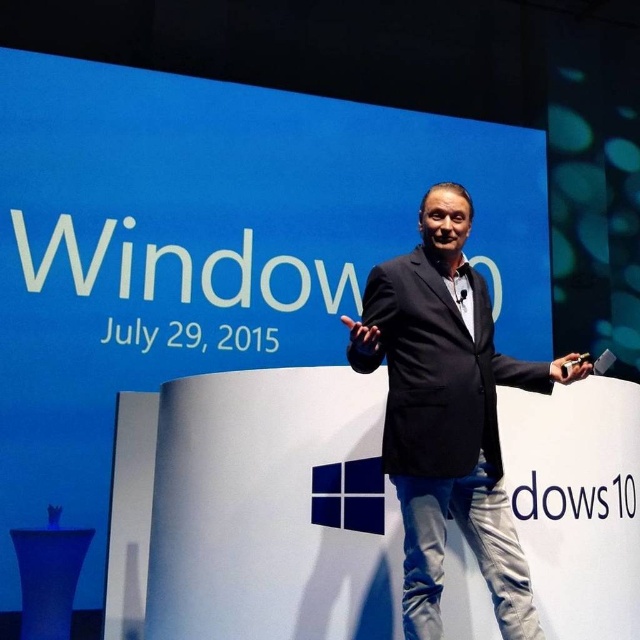
Consider the image. Does black matte suit at center appear under matte black remote at center?

Indeed, black matte suit at center is positioned under matte black remote at center.

Which is behind, point (433, 266) or point (582, 371)?

The point (433, 266) is more distant.

Is point (433, 614) behind point (572, 372)?

No, it is in front of (572, 372).

This screenshot has width=640, height=640. Identify the location of black matte suit at center. (445, 416).

Which of these two, black matte suit at center or black matte hand at center, stands taller?

black matte suit at center is taller.

Between black matte suit at center and black matte hand at center, which one is positioned lower?

Positioned lower is black matte suit at center.

Is point (461, 193) positioned before point (346, 316)?

Yes, point (461, 193) is in front of point (346, 316).

This screenshot has width=640, height=640. Find the location of `black matte suit at center`. black matte suit at center is located at coordinates (445, 416).

Can you confirm if matte black remote at center is bigger than black matte hand at center?

No, matte black remote at center is not bigger than black matte hand at center.

Is point (563, 371) closer to viewer compared to point (352, 317)?

That is True.

Who is more distant from viewer, (x=577, y=355) or (x=360, y=336)?

Point (x=577, y=355)

You are a GUI agent. You are given a task and a screenshot of the screen. Output one action in this format:
    pyautogui.click(x=<x>, y=<y>)
    Task: Click on the matte black remote at center
    Image resolution: width=640 pixels, height=640 pixels.
    Given the screenshot: What is the action you would take?
    pyautogui.click(x=570, y=368)